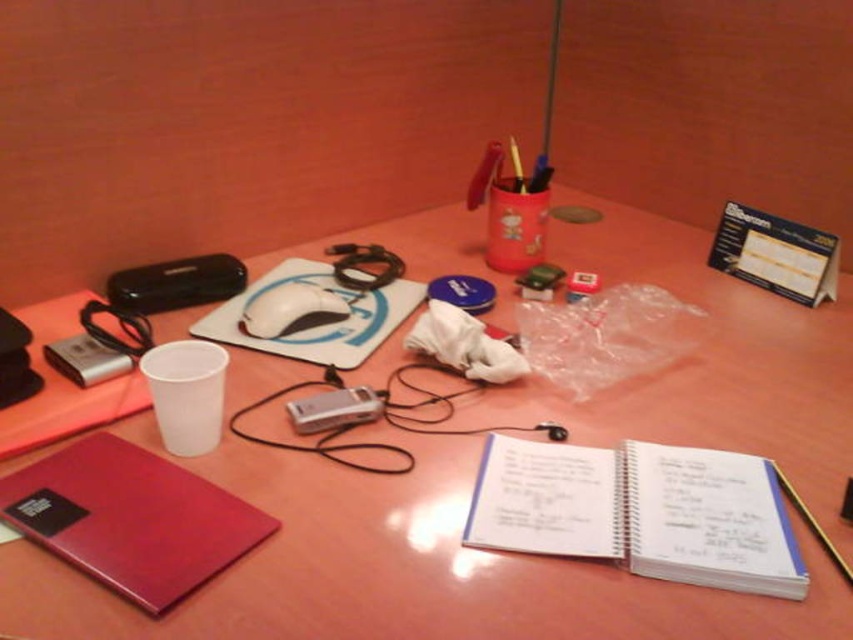
Does point (732, 394) come closer to viewer compared to point (369, 394)?

No.

Describe the element at coordinates (398, 570) in the screenshot. The height and width of the screenshot is (640, 853). I see `white plastic cup at upper left` at that location.

Which is in front, point (299, 604) or point (315, 397)?

Point (299, 604)

This screenshot has width=853, height=640. What are the coordinates of `white plastic cup at upper left` in the screenshot? It's located at (398, 570).

Between matte red notebook at lower left and silver metallic camera at center, which one has less height?

silver metallic camera at center is shorter.

Does matte red notebook at lower left come behind silver metallic camera at center?

No, matte red notebook at lower left is in front of silver metallic camera at center.

Describe the element at coordinates (131, 518) in the screenshot. I see `matte red notebook at lower left` at that location.

Find the location of a particular element. The width and height of the screenshot is (853, 640). matte red notebook at lower left is located at coordinates (131, 518).

Is white plastic cup at upper left wider than matte red notebook at lower left?

Yes.

Is point (775, 404) closer to camera compared to point (7, 518)?

No, it is not.

Describe the element at coordinates (398, 570) in the screenshot. The image size is (853, 640). I see `white plastic cup at upper left` at that location.

Locate an element on the screen. The image size is (853, 640). white plastic cup at upper left is located at coordinates (398, 570).